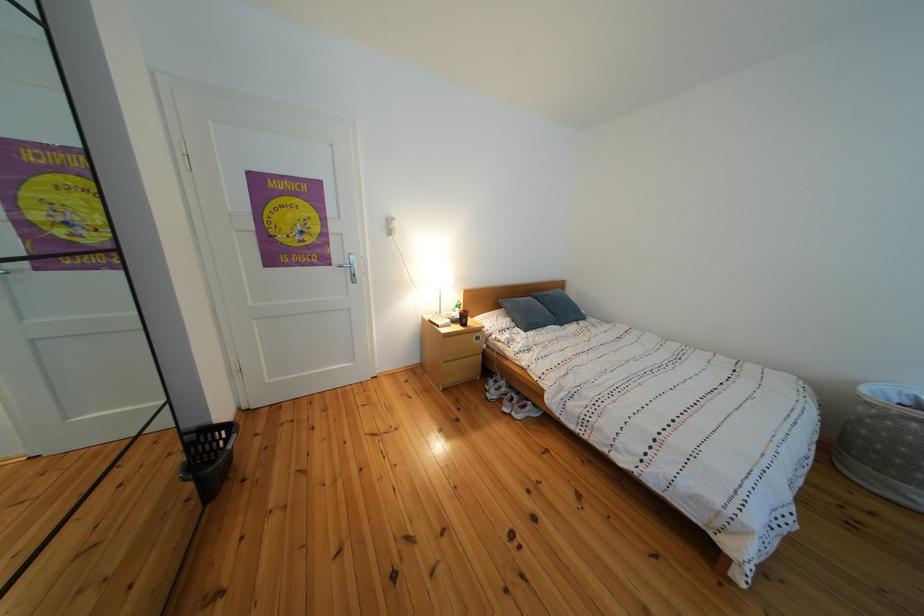
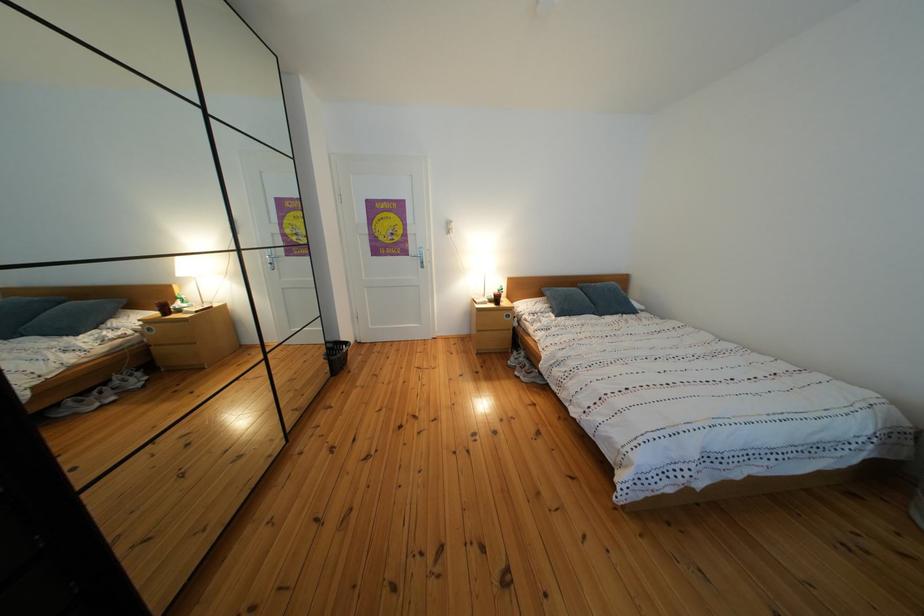
In a continuous first-person perspective shot, in which direction is the camera moving?

The cameraman moved toward right, backward.